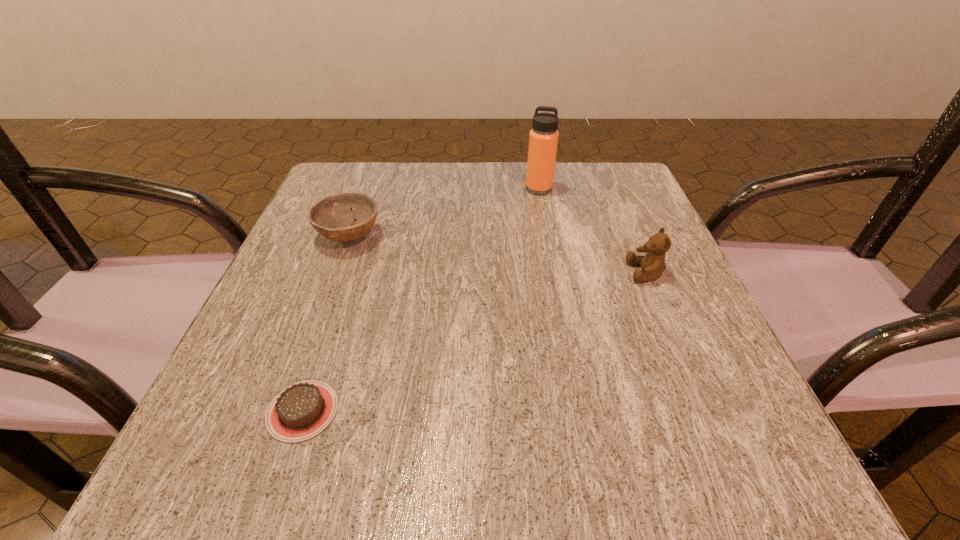
You are a GUI agent. You are given a task and a screenshot of the screen. Output one action in this format:
    pyautogui.click(x=<x>, y=<y>)
    Task: Click on the free spot between the third nearest object and the rightmost object
    Image resolution: width=960 pixels, height=540 pixels.
    Given the screenshot: What is the action you would take?
    pyautogui.click(x=497, y=254)

Where is `vacant area between the rightmost object and the tallest object`? The width and height of the screenshot is (960, 540). vacant area between the rightmost object and the tallest object is located at coordinates (592, 231).

Image resolution: width=960 pixels, height=540 pixels. I want to click on vacant region between the thermos bottle and the third shortest object, so click(x=592, y=231).

This screenshot has width=960, height=540. In order to click on blank region between the nearest object and the thermos bottle in this screenshot , I will do `click(420, 300)`.

At what (x,y) coordinates should I click in order to perform the action: click on vacant area between the rightmost object and the second farthest object. Please return your answer as a coordinate pair (x, y). Looking at the image, I should click on (497, 254).

Identify the location of empty space that is in between the tallest object and the rightmost object. Image resolution: width=960 pixels, height=540 pixels. (592, 231).

The height and width of the screenshot is (540, 960). I want to click on free space between the second tallest object and the second shortest object, so [x=497, y=254].

Identify which object is the closest to the nearest object. Please provide its 2D coordinates. Your answer should be formatted as a tuple, i.e. [(x, y)], where the tuple contains the x and y coordinates of a point satisfying the conditions above.

[(333, 217)]

In order to click on object identified as the second closest to the thermos bottle in this screenshot , I will do `click(333, 217)`.

Locate an element on the screen. The width and height of the screenshot is (960, 540). vacant space that satisfies the following two spatial constraints: 1. on the front-facing side of the second tallest object; 2. on the front side of the chocolate cake is located at coordinates coord(704,411).